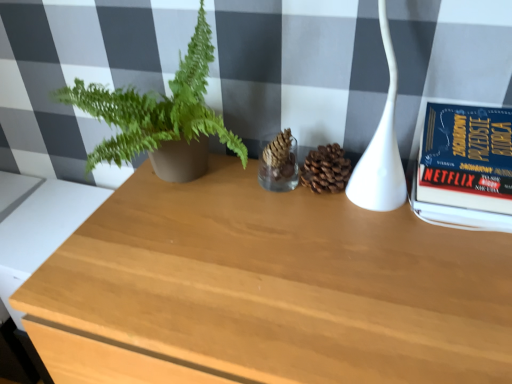
This screenshot has width=512, height=384. Identify the location of vacant area that is in front of hardcover book at right. (469, 273).